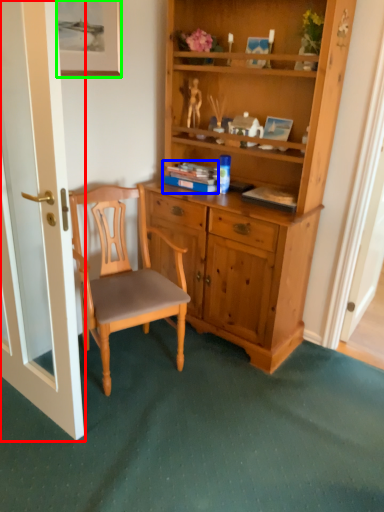
Question: Considering the real-world distances, which object is farthest from door (highlighted by a red box)? book (highlighted by a blue box) or picture frame (highlighted by a green box)?

Choices:
 (A) book
 (B) picture frame

Answer: (A)